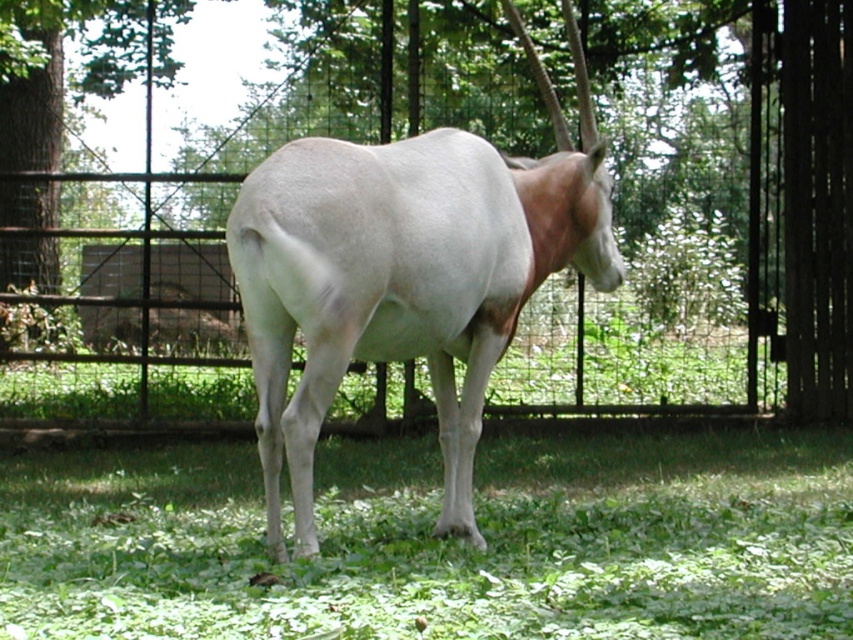
You are standing at the point marked as point (82,67) in the image. Looking around, you see a white oryx in the enclosure. Which direction should you face to see the green leafy tree at center?

The point (82,67) corresponds to the green leafy tree at center, so you are already facing it.

You are a visitor at the zoo and want to take a photo of the white smooth tail at center and the green leafy tree at center. Which object should you focus on first to ensure both are in the frame?

You should focus on the green leafy tree at center first because it is closer to you than the white smooth tail at center, ensuring both are in the frame.

You are a zookeeper who needs to place a new feeding station between the metallic wire fence at center and the green leafy tree at center. The feeding station requires a minimum of 3 meters of space to be placed safely. Based on the scene, can the feeding station be placed between them?

The distance between the metallic wire fence at center and the green leafy tree at center is 2.84 meters, which is less than the required 3 meters. Therefore, the feeding station cannot be safely placed between them.